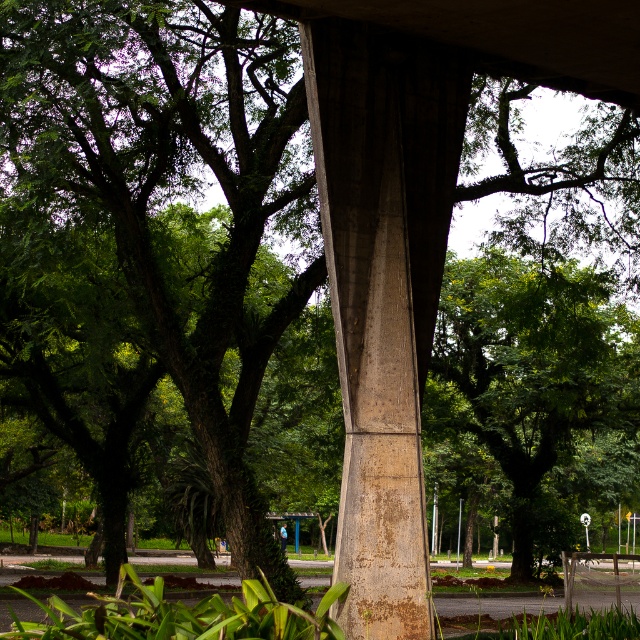
Based on the photo, you are standing in front of the large concrete pillar and notice two points marked on the image. The first point is at coordinates point (355,621) and the second is at point (528,74). Which point is nearer to your current position?

Point (355,621) is closer to the camera than point (528,74), so the first point is nearer to your current position.

You are a bird looking for a place to perch. You see a green leafy tree at center and a rusty concrete pillar at center. Which one is taller and would allow you to have a better view of the surroundings?

The green leafy tree at center is taller than the rusty concrete pillar at center, so perching there would provide a better view of the surroundings.